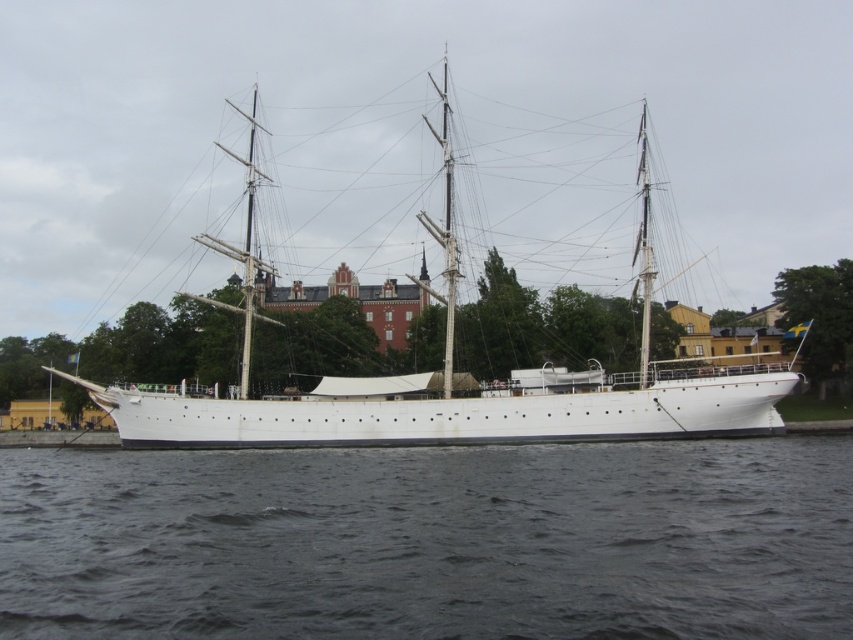
You are standing on the waterfront and want to determine the relative positions of two points marked on the ship. Which point is closer to you, point (x=103, y=552) or point (x=735, y=406)?

Point (x=103, y=552) is closer to the viewer than point (x=735, y=406).

You are an observer standing on the dock looking at the dark gray water at lower center and the white matte sailboat at center. Which object takes up more visual space in the image?

The white matte sailboat at center occupies more visual space than the dark gray water at lower center, as stated in the description.